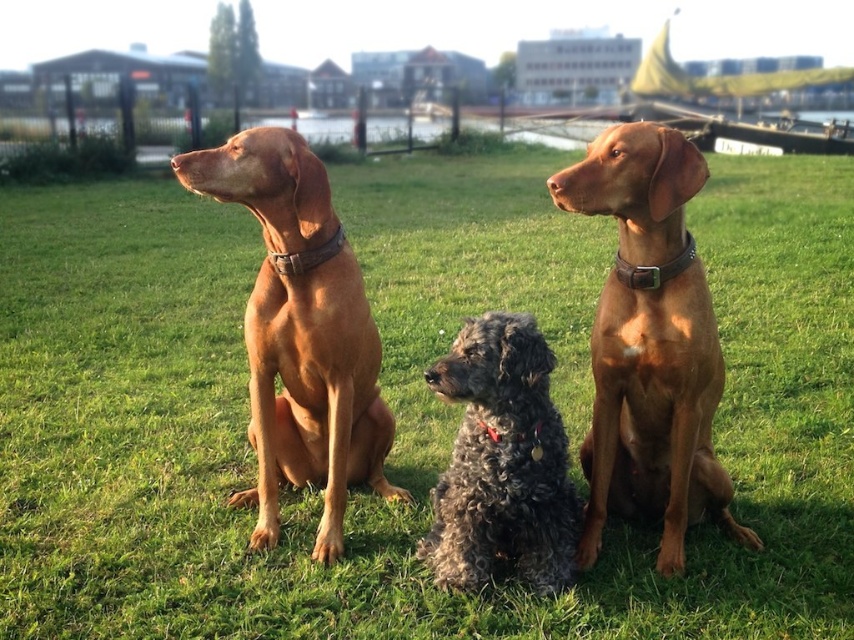
Question: Does matte brown dog at center appear over curly gray fur at center?

Choices:
 (A) yes
 (B) no

Answer: (A)

Question: Which point is closer to the camera?

Choices:
 (A) (651, 212)
 (B) (272, 131)

Answer: (A)

Question: Among these points, which one is farthest from the camera?

Choices:
 (A) (297, 412)
 (B) (509, 490)

Answer: (A)

Question: Is matte brown dog at center closer to the viewer compared to curly gray fur at center?

Choices:
 (A) yes
 (B) no

Answer: (A)

Question: Is matte brown dog at center positioned in front of curly gray fur at center?

Choices:
 (A) no
 (B) yes

Answer: (B)

Question: Which of the following is the closest to the observer?

Choices:
 (A) curly gray fur at center
 (B) matte brown dog at center

Answer: (B)